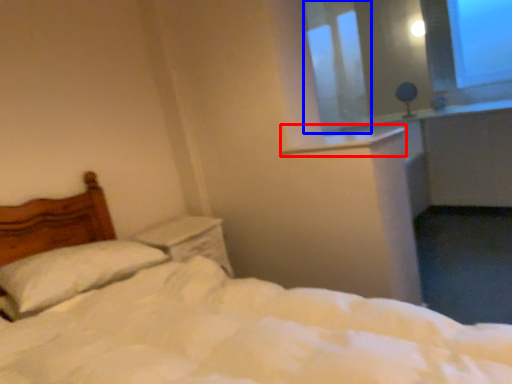
Question: Among these objects, which one is nearest to the camera, window sill (highlighted by a red box) or window screen (highlighted by a blue box)?

Choices:
 (A) window sill
 (B) window screen

Answer: (A)